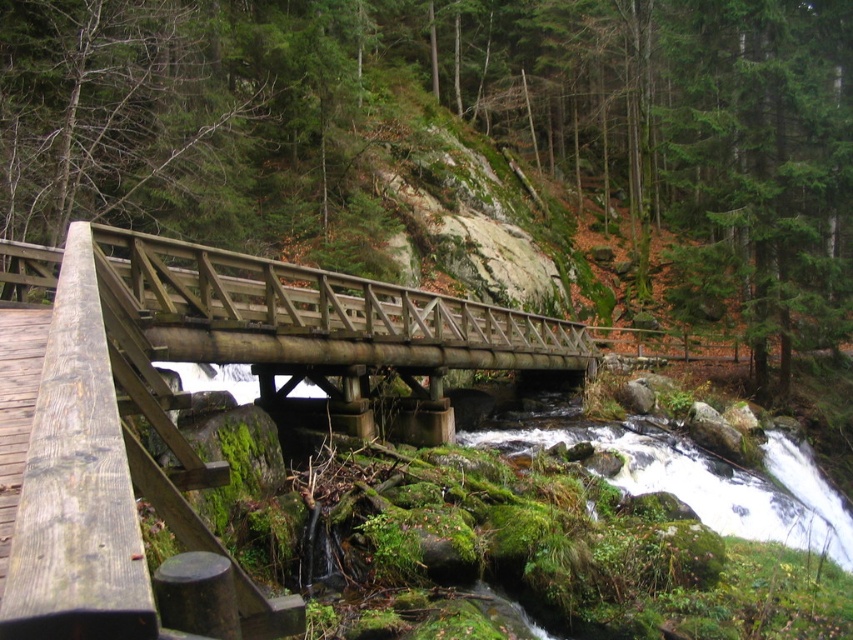
Can you confirm if green mossy rocks at center is wider than weathered wood foot bridge at center?

Correct, the width of green mossy rocks at center exceeds that of weathered wood foot bridge at center.

Who is more distant from viewer, (521, 120) or (383, 337)?

Point (521, 120)

Between point (834, 74) and point (450, 312), which one is positioned in front?

Point (450, 312) is more forward.

Where is `green mossy rocks at center`? The height and width of the screenshot is (640, 853). green mossy rocks at center is located at coordinates (456, 116).